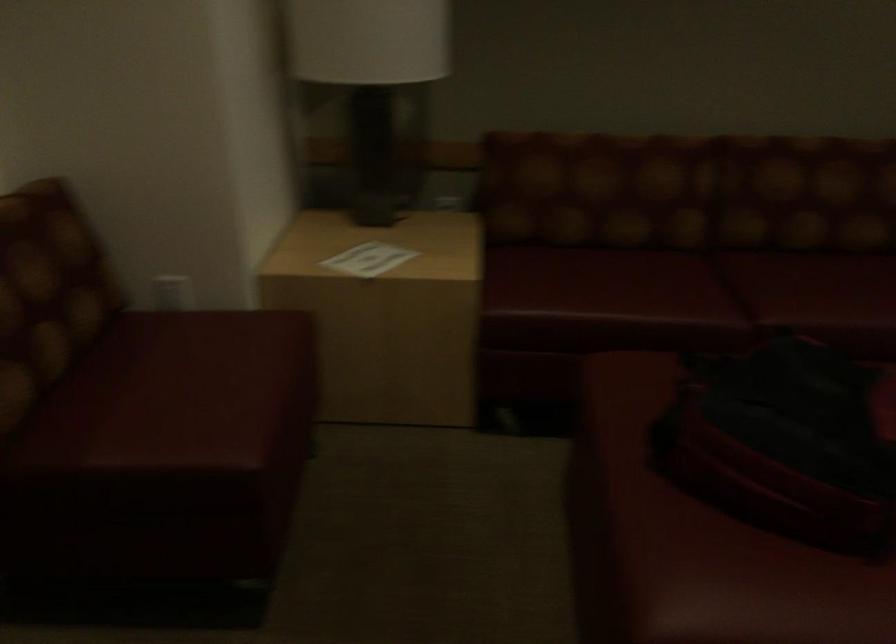
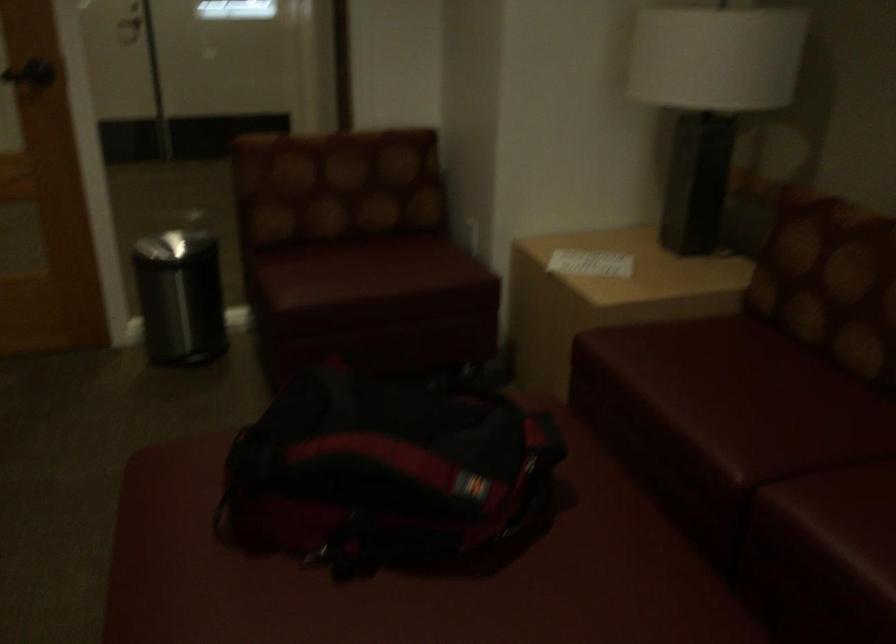
The point at (634, 289) is marked in the first image. Where is the corresponding point in the second image?

(731, 397)